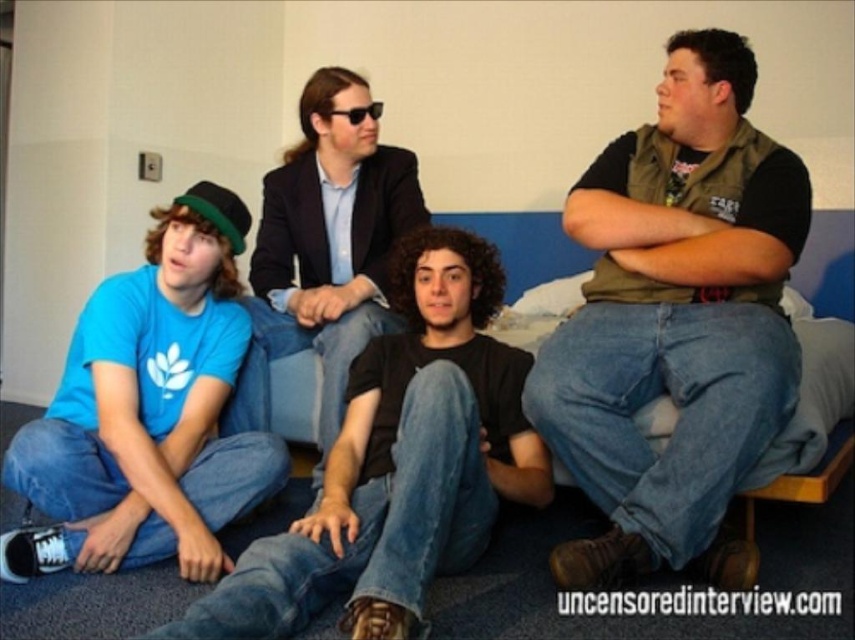
Question: Does satin black blazer at center have a larger size compared to black plastic sunglasses at center?

Choices:
 (A) no
 (B) yes

Answer: (B)

Question: Estimate the real-world distances between objects in this image. Which object is closer to the black plastic sunglasses at center?

Choices:
 (A) green matte vest at center
 (B) matte blue t-shirt at lower left

Answer: (B)

Question: Which of these objects is positioned farthest from the green matte vest at center?

Choices:
 (A) matte blue t-shirt at lower left
 (B) blue cotton t-shirt at left
 (C) black plastic sunglasses at center

Answer: (C)

Question: Is green matte vest at center thinner than black plastic sunglasses at center?

Choices:
 (A) yes
 (B) no

Answer: (B)

Question: Can you confirm if green matte vest at center is bigger than matte blue t-shirt at lower left?

Choices:
 (A) yes
 (B) no

Answer: (A)

Question: Which point is farther from the camera taking this photo?

Choices:
 (A) (246, 365)
 (B) (268, 492)
 (C) (736, 419)

Answer: (A)